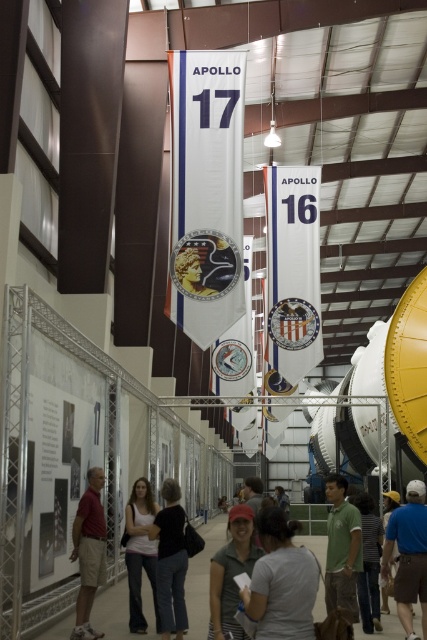
Question: Which point is closer to the camera?

Choices:
 (A) (157, 531)
 (B) (391, 515)
 (C) (344, 611)

Answer: (C)

Question: Which of these objects is positioned closest to the green matte shirt at center?

Choices:
 (A) matte gray shirt at center
 (B) red shirt at left
 (C) dark gray pants at center

Answer: (A)

Question: Can you confirm if gray fabric shirt at center is smaller than matte gray shirt at center?

Choices:
 (A) yes
 (B) no

Answer: (A)

Question: Is matte gray shirt at center bigger than white cotton shirt at center?

Choices:
 (A) yes
 (B) no

Answer: (A)

Question: Observing the image, what is the correct spatial positioning of gray fabric shirt at center in reference to dark gray pants at center?

Choices:
 (A) below
 (B) above

Answer: (B)

Question: Which object is farther from the camera taking this photo?

Choices:
 (A) green matte shirt at center
 (B) red shirt at left

Answer: (B)